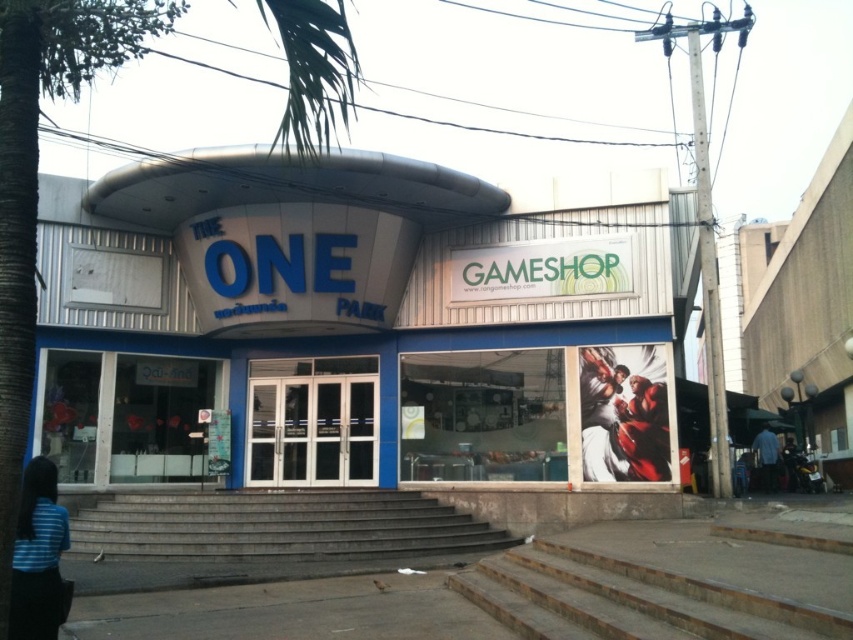
Question: Is gray concrete stairs at lower center in front of red glossy figure at center?

Choices:
 (A) no
 (B) yes

Answer: (B)

Question: Among these points, which one is nearest to the camera?

Choices:
 (A) (357, 493)
 (B) (625, 460)
 (C) (712, 621)

Answer: (C)

Question: Is blue glass building at center positioned behind brown concrete stairs at lower center?

Choices:
 (A) no
 (B) yes

Answer: (B)

Question: Which object is closer to the camera taking this photo?

Choices:
 (A) blue fabric shirt at lower right
 (B) blue glass building at center
 (C) brown concrete stairs at lower center
 (D) green leafy palm tree at upper left

Answer: (C)

Question: Estimate the real-world distances between objects in this image. Which object is farther from the blue striped shirt at lower left?

Choices:
 (A) blue glass building at center
 (B) red glossy figure at center

Answer: (B)

Question: Can you confirm if smooth canvas figure at right is positioned to the left of blue fabric shirt at lower right?

Choices:
 (A) yes
 (B) no

Answer: (A)